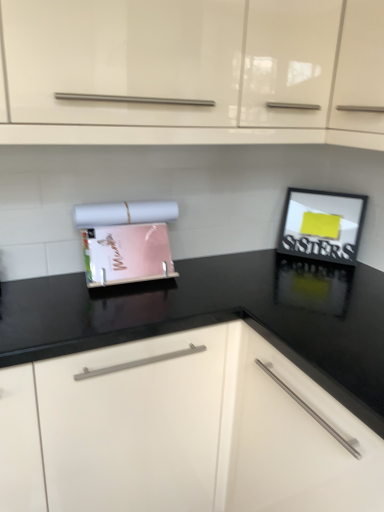
Question: From the image's perspective, would you say black matte picture frame at upper right is positioned over matte plastic magazine holder at center?

Choices:
 (A) no
 (B) yes

Answer: (B)

Question: Is black matte picture frame at upper right located outside matte plastic magazine holder at center?

Choices:
 (A) yes
 (B) no

Answer: (A)

Question: Does black matte picture frame at upper right have a smaller size compared to matte plastic magazine holder at center?

Choices:
 (A) yes
 (B) no

Answer: (A)

Question: Is black matte picture frame at upper right taller than matte plastic magazine holder at center?

Choices:
 (A) yes
 (B) no

Answer: (B)

Question: Could you tell me if black matte picture frame at upper right is turned towards matte plastic magazine holder at center?

Choices:
 (A) yes
 (B) no

Answer: (B)

Question: Which is correct: matte plastic magazine holder at center is inside black glossy countertop at center, the first cabinetry in the bottom-to-top sequence, or outside of it?

Choices:
 (A) inside
 (B) outside

Answer: (B)

Question: In terms of width, does matte plastic magazine holder at center look wider or thinner when compared to black glossy countertop at center, placed as the 2th cabinetry when sorted from top to bottom?

Choices:
 (A) thin
 (B) wide

Answer: (A)

Question: Considering the positions of matte plastic magazine holder at center and black glossy countertop at center, the first cabinetry in the bottom-to-top sequence, in the image, is matte plastic magazine holder at center bigger or smaller than black glossy countertop at center, the first cabinetry in the bottom-to-top sequence,?

Choices:
 (A) big
 (B) small

Answer: (B)

Question: Considering the positions of point (119, 265) and point (254, 415), is point (119, 265) closer or farther from the camera than point (254, 415)?

Choices:
 (A) farther
 (B) closer

Answer: (A)

Question: Is glossy white cabinet at upper center, which appears as the 1th cabinetry when viewed from the top, taller or shorter than black matte picture frame at upper right?

Choices:
 (A) short
 (B) tall

Answer: (B)

Question: Which is correct: glossy white cabinet at upper center, which appears as the 1th cabinetry when viewed from the top, is inside black matte picture frame at upper right, or outside of it?

Choices:
 (A) inside
 (B) outside

Answer: (B)

Question: In the image, is glossy white cabinet at upper center, which appears as the 1th cabinetry when viewed from the top, positioned in front of or behind black matte picture frame at upper right?

Choices:
 (A) behind
 (B) front

Answer: (B)

Question: From the image's perspective, is glossy white cabinet at upper center, which appears as the 1th cabinetry when viewed from the top, located above or below black matte picture frame at upper right?

Choices:
 (A) below
 (B) above

Answer: (B)

Question: In the image, is black matte picture frame at upper right positioned in front of or behind black glossy countertop at center, placed as the 2th cabinetry when sorted from top to bottom?

Choices:
 (A) front
 (B) behind

Answer: (B)

Question: Would you say black matte picture frame at upper right is to the left or to the right of black glossy countertop at center, placed as the 2th cabinetry when sorted from top to bottom, in the picture?

Choices:
 (A) left
 (B) right

Answer: (B)